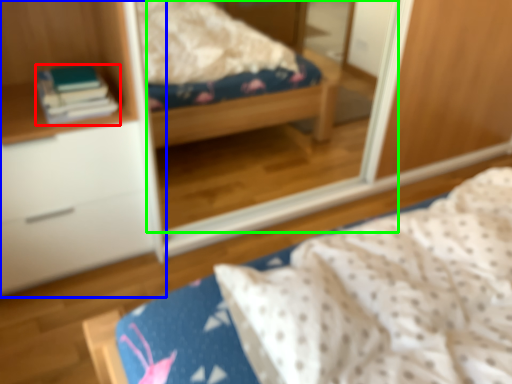
Question: Based on their relative distances, which object is nearer to book (highlighted by a red box)? Choose from cabinetry (highlighted by a blue box) and mirror (highlighted by a green box).

Choices:
 (A) cabinetry
 (B) mirror

Answer: (A)